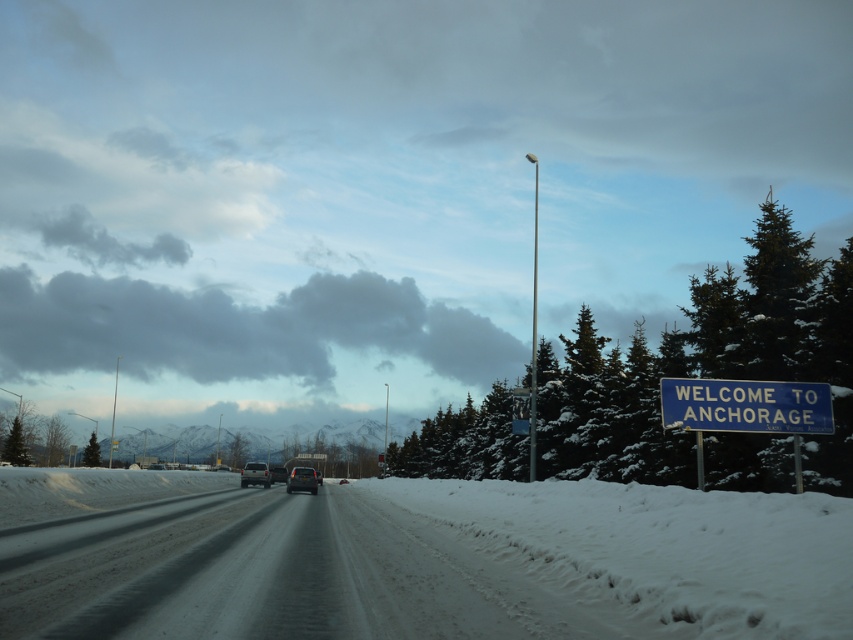
You are planning a road trip and see the dark gray fluffy cloud at upper center and the matte black suv at center. Which object is located to the left of the other?

The dark gray fluffy cloud at upper center is positioned on the left side of matte black suv at center.

You are a weather observer standing at the entrance to Anchorage, Alaska, as shown in the image. You need to report the position of the dark gray fluffy cloud at upper center relative to the welcome sign. Can you determine its location using coordinates?

The dark gray fluffy cloud at upper center is located at coordinates point [238,330], which places it above and slightly to the left of the welcome sign.

You are a driver approaching Anchorage and see the matte black suv at center and the dark gray fluffy cloud at upper center. Which object is closer to you?

The dark gray fluffy cloud at upper center is closer to you because the matte black suv at center is behind it.